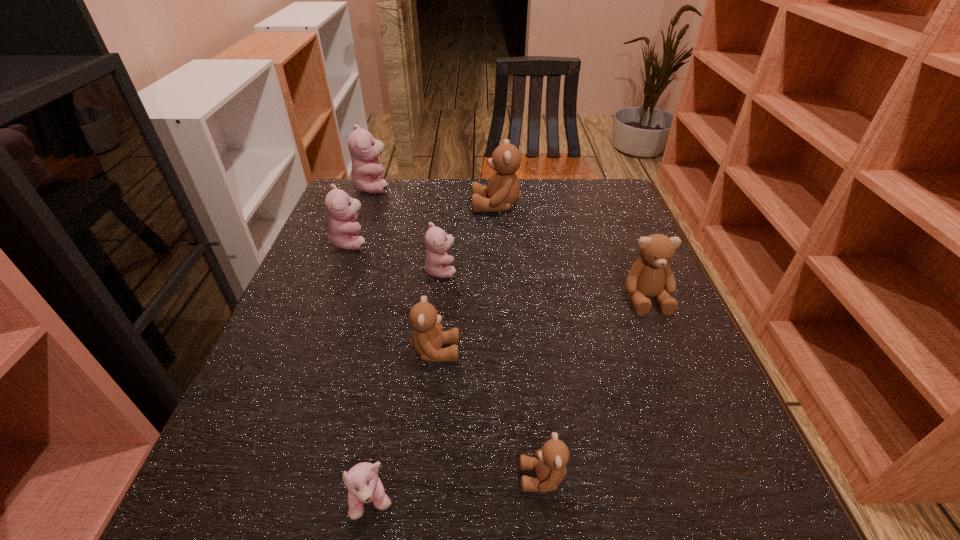
Find the location of a particular element. Image resolution: width=960 pixels, height=540 pixels. free spot at the far right corner of the desktop is located at coordinates (629, 212).

Find the location of a particular element. The image size is (960, 540). vacant region between the rightmost object and the second nearest pink teddy bear is located at coordinates (543, 285).

The width and height of the screenshot is (960, 540). Find the location of `free space between the third smallest pink teddy bear and the smallest pink teddy bear`. free space between the third smallest pink teddy bear and the smallest pink teddy bear is located at coordinates (362, 373).

The width and height of the screenshot is (960, 540). I want to click on free space between the third smallest pink teddy bear and the biggest brown teddy bear, so click(x=423, y=224).

Locate an element on the screen. This screenshot has height=540, width=960. vacant point located between the sixth nearest teddy bear and the fourth nearest teddy bear is located at coordinates (498, 271).

At what (x,y) coordinates should I click in order to perform the action: click on free area in between the farthest pink teddy bear and the second biggest pink teddy bear. Please return your answer as a coordinate pair (x, y). Image resolution: width=960 pixels, height=540 pixels. Looking at the image, I should click on (362, 214).

Locate an element on the screen. free space between the third nearest pink teddy bear and the second nearest brown teddy bear is located at coordinates (394, 296).

Locate an element on the screen. Image resolution: width=960 pixels, height=540 pixels. free spot between the third smallest pink teddy bear and the second smallest pink teddy bear is located at coordinates (396, 256).

Where is `vacant space that's between the biggest pink teddy bear and the second smallest pink teddy bear`? The image size is (960, 540). vacant space that's between the biggest pink teddy bear and the second smallest pink teddy bear is located at coordinates (407, 229).

Where is `vacant space in between the third nearest teddy bear and the farthest brown teddy bear`? vacant space in between the third nearest teddy bear and the farthest brown teddy bear is located at coordinates (466, 278).